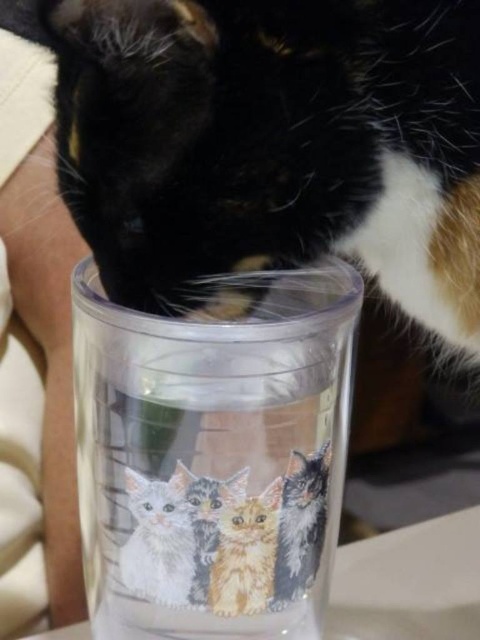
Is the position of calico fur cat at center less distant than that of white fur cat at lower center?

That is True.

Locate an element on the screen. calico fur cat at center is located at coordinates (271, 141).

At what (x,y) coordinates should I click in order to perform the action: click on calico fur cat at center. Please return your answer as a coordinate pair (x, y). This screenshot has width=480, height=640. Looking at the image, I should click on (271, 141).

Is calico fur cat at center to the right of transparent plastic cup at center from the viewer's perspective?

Correct, you'll find calico fur cat at center to the right of transparent plastic cup at center.

Does point (76, 99) come in front of point (235, 493)?

That is False.

The image size is (480, 640). In order to click on calico fur cat at center in this screenshot , I will do `click(271, 141)`.

Is calico fur cat at center wider than fluffy orange kitten at center?

Indeed, calico fur cat at center has a greater width compared to fluffy orange kitten at center.

Describe the element at coordinates (271, 141) in the screenshot. The width and height of the screenshot is (480, 640). I see `calico fur cat at center` at that location.

You are a GUI agent. You are given a task and a screenshot of the screen. Output one action in this format:
    pyautogui.click(x=<x>, y=<y>)
    Task: Click on the calico fur cat at center
    This screenshot has width=480, height=640.
    Given the screenshot: What is the action you would take?
    pyautogui.click(x=271, y=141)